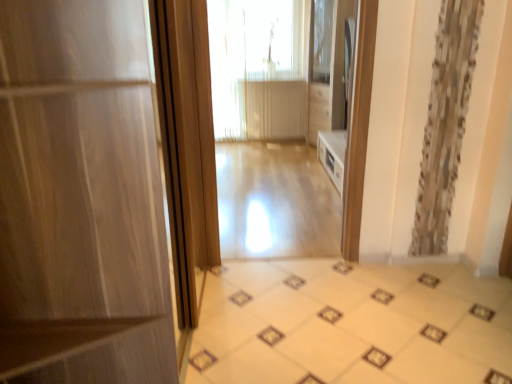
What do you see at coordinates (278, 69) in the screenshot? I see `light wood floor at center` at bounding box center [278, 69].

Measure the distance between point (221, 223) and camera.

The distance of point (221, 223) from camera is 3.31 meters.

What do you see at coordinates (257, 68) in the screenshot?
I see `translucent fabric at center` at bounding box center [257, 68].

What are the coordinates of `light wood floor at center` in the screenshot? It's located at (278, 69).

Are light wood floor at center and translucent fabric at center far apart?

Indeed, light wood floor at center is not near translucent fabric at center.

Is light wood floor at center closer to the viewer compared to translucent fabric at center?

Yes, light wood floor at center is closer to the camera.

How many degrees apart are the facing directions of light wood floor at center and translucent fabric at center?

→ The angle between the facing direction of light wood floor at center and the facing direction of translucent fabric at center is 0.338 degrees.

In the image, is light wood floor at center on the left side or the right side of translucent fabric at center?

In the image, light wood floor at center appears on the right side of translucent fabric at center.

This screenshot has height=384, width=512. Identify the location of residence located behind the matte wood door at left. (278, 69).

Would you say light wood floor at center is outside matte wood door at left?

Yes, light wood floor at center is located beyond the bounds of matte wood door at left.

How many degrees apart are the facing directions of light wood floor at center and matte wood door at left?

89.8 degrees separate the facing orientations of light wood floor at center and matte wood door at left.

From the image's perspective, is light wood floor at center located above or below matte wood door at left?

light wood floor at center is situated higher than matte wood door at left in the image.

Can you tell me how much light wood floor at center and beige glossy tile at center differ in facing direction?

They differ by 180 degrees in their facing directions.

Are light wood floor at center and beige glossy tile at center located far from each other?

Yes, light wood floor at center and beige glossy tile at center are quite far apart.

From a real-world perspective, is light wood floor at center physically below beige glossy tile at center?

No.

Which object is wider, light wood floor at center or beige glossy tile at center?

Wider between the two is light wood floor at center.

Based on the photo, from the image's perspective, who appears lower, matte wood door at left or light wood floor at center?

From the image's view, matte wood door at left is below.

Where is `door that is below the light wood floor at center (from the image's perspective)`? door that is below the light wood floor at center (from the image's perspective) is located at coordinates (83, 185).

Are matte wood door at left and light wood floor at center located far from each other?

Yes, matte wood door at left and light wood floor at center are quite far apart.

Does matte wood door at left come behind light wood floor at center?

No, it is not.

Considering the relative positions of beige glossy tile at center and matte wood door at left in the image provided, is beige glossy tile at center to the left or to the right of matte wood door at left?

beige glossy tile at center is positioned on matte wood door at left's right side.

Can you tell me how much beige glossy tile at center and matte wood door at left differ in facing direction?

Result: The angular difference between beige glossy tile at center and matte wood door at left is 88.5 degrees.

Is there a large distance between beige glossy tile at center and matte wood door at left?

beige glossy tile at center is far away from matte wood door at left.

In terms of size, does beige glossy tile at center appear bigger or smaller than matte wood door at left?

beige glossy tile at center is smaller than matte wood door at left.

Could you tell me if translucent fabric at center is facing matte wood door at left?

Yes, translucent fabric at center is facing matte wood door at left.

Which is behind, translucent fabric at center or matte wood door at left?

translucent fabric at center is behind.

Looking at this image, from a real-world perspective, who is located higher, translucent fabric at center or matte wood door at left?

In real-world perspective, translucent fabric at center is above.

From the image's perspective, is translucent fabric at center on beige glossy tile at center?

Yes, from the image's perspective, translucent fabric at center is over beige glossy tile at center.

The image size is (512, 384). In order to click on ceramic tile located in front of the translucent fabric at center in this screenshot , I will do `click(351, 324)`.

From a real-world perspective, is translucent fabric at center above or below beige glossy tile at center?

Clearly, from a real-world perspective, translucent fabric at center is above beige glossy tile at center.

Looking at this image, is translucent fabric at center not near beige glossy tile at center?

That's right, there is a large distance between translucent fabric at center and beige glossy tile at center.

The height and width of the screenshot is (384, 512). I want to click on corridor that appears below the translucent fabric at center (from a real-world perspective), so click(x=275, y=201).

Where is `residence behind the matte wood door at left`? Image resolution: width=512 pixels, height=384 pixels. residence behind the matte wood door at left is located at coordinates (278, 69).

Based on their spatial positions, is light wood floor at center or light wood floor at center further from translucent fabric at center?

light wood floor at center.

Which object lies further to the anchor point beige glossy tile at center, light wood floor at center or light wood floor at center?

light wood floor at center is further to beige glossy tile at center.

Considering their positions, is translucent fabric at center positioned further to light wood floor at center than beige glossy tile at center?

Based on the image, translucent fabric at center appears to be further to light wood floor at center.

Based on their spatial positions, is beige glossy tile at center or matte wood door at left closer to light wood floor at center?

The object closer to light wood floor at center is beige glossy tile at center.

When comparing their distances from beige glossy tile at center, does matte wood door at left or translucent fabric at center seem further?

Among the two, translucent fabric at center is located further to beige glossy tile at center.

When comparing their distances from matte wood door at left, does light wood floor at center or translucent fabric at center seem closer?

The object closer to matte wood door at left is light wood floor at center.

In the scene shown: From the image, which object appears to be farther from matte wood door at left, light wood floor at center or beige glossy tile at center?

Based on the image, light wood floor at center appears to be further to matte wood door at left.

From the image, which object appears to be farther from light wood floor at center, beige glossy tile at center or light wood floor at center?

light wood floor at center is further to light wood floor at center.

Where is `corridor between beige glossy tile at center and translucent fabric at center along the z-axis`? Image resolution: width=512 pixels, height=384 pixels. corridor between beige glossy tile at center and translucent fabric at center along the z-axis is located at coordinates (275, 201).

Where is `residence between matte wood door at left and light wood floor at center from front to back`? residence between matte wood door at left and light wood floor at center from front to back is located at coordinates (278, 69).

You are a GUI agent. You are given a task and a screenshot of the screen. Output one action in this format:
    pyautogui.click(x=<x>, y=<y>)
    Task: Click on the ceramic tile located between matte wood door at left and translucent fabric at center in the depth direction
    
    Given the screenshot: What is the action you would take?
    pyautogui.click(x=351, y=324)

What are the coordinates of `residence located between beige glossy tile at center and light wood floor at center in the depth direction` in the screenshot? It's located at (278, 69).